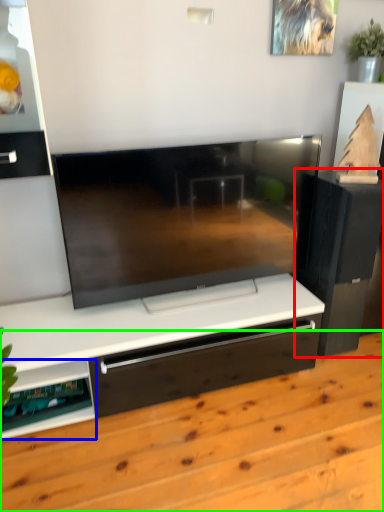
Question: Which is farther away from furniture (highlighted by a red box)? shelf (highlighted by a blue box) or hardwood (highlighted by a green box)?

Choices:
 (A) shelf
 (B) hardwood

Answer: (A)